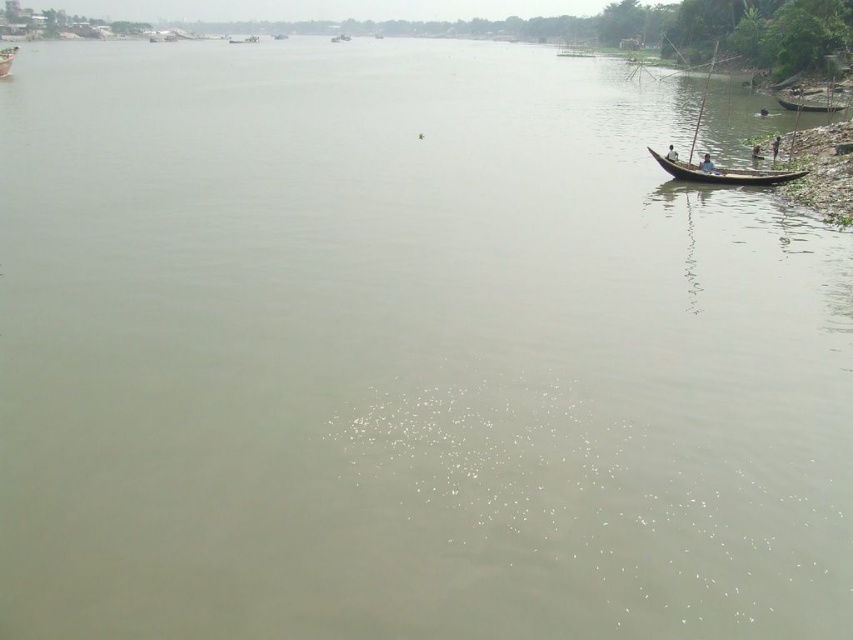
Which is more to the left, wooden paddle at right or blue fabric person at right?

From the viewer's perspective, blue fabric person at right appears more on the left side.

Can you confirm if wooden paddle at right is positioned below blue fabric person at right?

Actually, wooden paddle at right is above blue fabric person at right.

The width and height of the screenshot is (853, 640). I want to click on wooden paddle at right, so click(701, 100).

How far apart are blue fabric person at right and dark brown wooden boat at right?

blue fabric person at right is 5.46 feet from dark brown wooden boat at right.

Which is behind, point (711, 164) or point (668, 147)?

Point (668, 147)

Where is `blue fabric person at right`? This screenshot has height=640, width=853. blue fabric person at right is located at coordinates (706, 163).

Between wooden boat at upper left and light blue fabric boat at right, which one is positioned lower?

light blue fabric boat at right is lower down.

Measure the distance between wooden boat at upper left and light blue fabric boat at right.

wooden boat at upper left and light blue fabric boat at right are 116.71 meters apart from each other.

Is point (9, 67) positioned behind point (756, 161)?

Yes, it is.

At what (x,y) coordinates should I click in order to perform the action: click on wooden boat at upper left. Please return your answer as a coordinate pair (x, y). The width and height of the screenshot is (853, 640). Looking at the image, I should click on (6, 60).